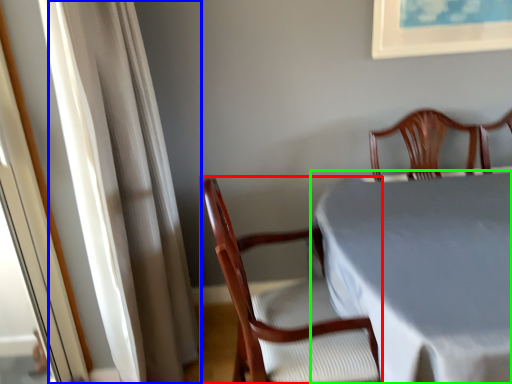
Question: Which is farther away from chair (highlighted by a red box)? curtain (highlighted by a blue box) or table (highlighted by a green box)?

Choices:
 (A) curtain
 (B) table

Answer: (A)